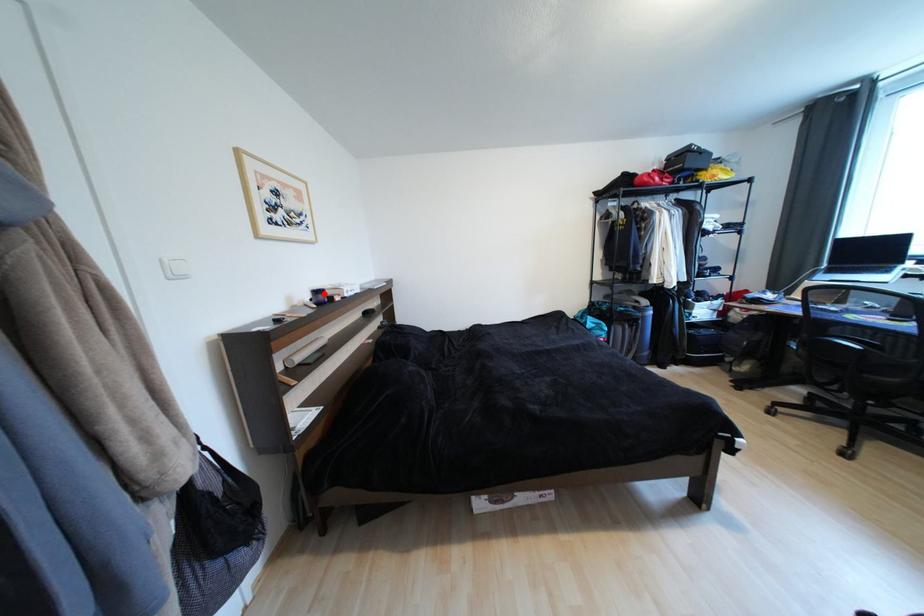
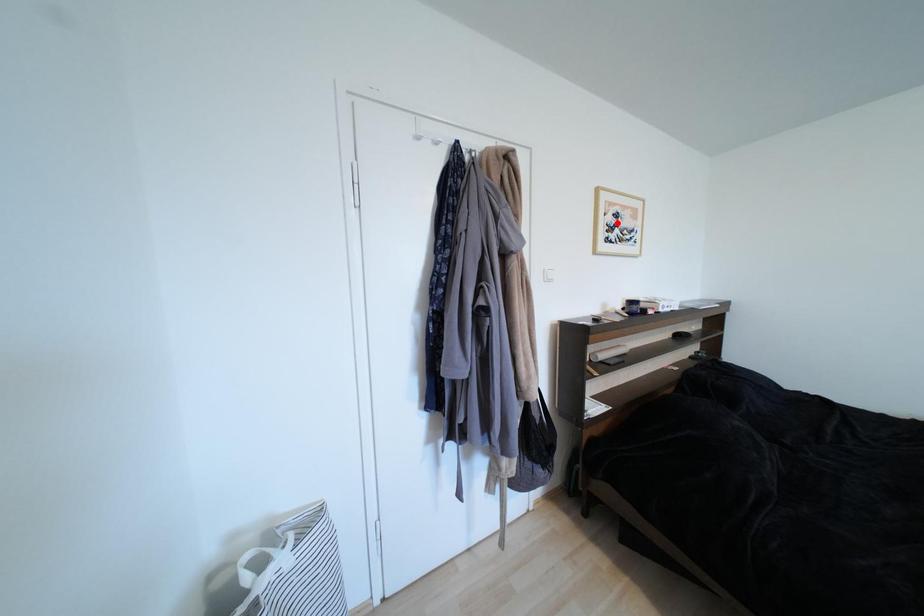
Based on the photo, I am providing you with two images of the same scene from different viewpoints. A red point is marked on the first image and another point is marked on the second image. Are the points marked in image1 and image2 representing the same 3D position?

No